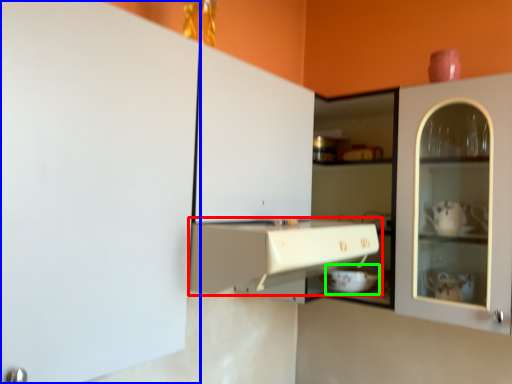
Question: Which is nearer to the cabinetry (highlighted by a red box)? cabinetry (highlighted by a blue box) or appliance (highlighted by a green box).

Choices:
 (A) cabinetry
 (B) appliance

Answer: (A)